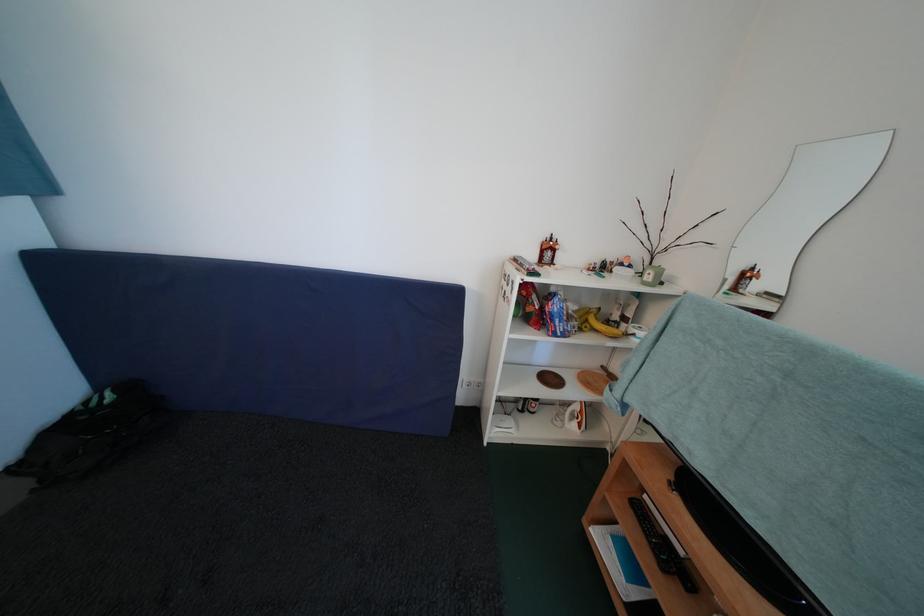
The location [575,416] corresponds to which object?

It corresponds to the white paper roll in the image.